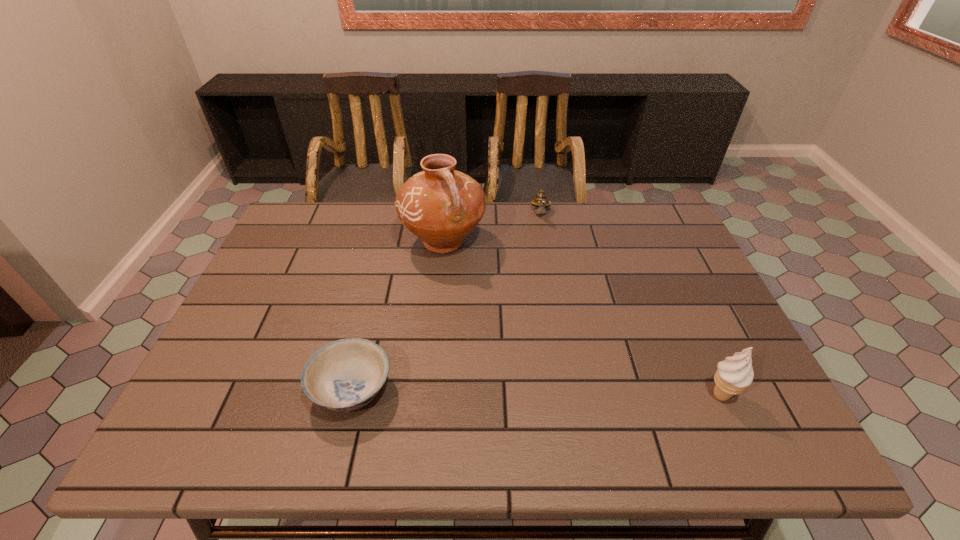
Where is `blank area located on the face of the snail`? The image size is (960, 540). blank area located on the face of the snail is located at coordinates (546, 306).

Where is `vacant area located 0.310m on the face of the snail`? vacant area located 0.310m on the face of the snail is located at coordinates (546, 293).

The height and width of the screenshot is (540, 960). Identify the location of blank space located 0.320m on the face of the snail. (546, 295).

This screenshot has width=960, height=540. Identify the location of pottery at the far edge. (441, 206).

Find the location of a particular element. Image resolution: width=960 pixels, height=540 pixels. snail at the far edge is located at coordinates (541, 202).

The height and width of the screenshot is (540, 960). I want to click on bowl at the near edge, so click(x=344, y=375).

At what (x,y) coordinates should I click in order to perform the action: click on icecream that is at the near edge. Please return your answer as a coordinate pair (x, y). The width and height of the screenshot is (960, 540). Looking at the image, I should click on point(734,374).

Locate an element on the screen. object at the right edge is located at coordinates (734, 374).

Identify the location of object present at the near right corner. (734, 374).

Identify the location of free space at the far edge of the desktop. (601, 247).